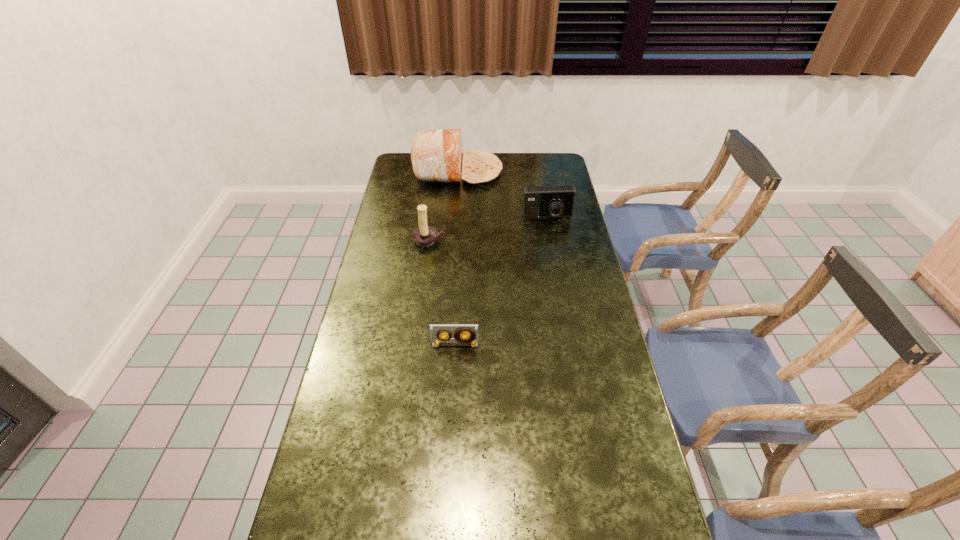
The height and width of the screenshot is (540, 960). Find the location of `vacant space in between the candle holder and the shortest object`. vacant space in between the candle holder and the shortest object is located at coordinates (443, 293).

Locate an element on the screen. unoccupied area between the third nearest object and the candle holder is located at coordinates (489, 230).

Locate an element on the screen. The image size is (960, 540). free space between the third farthest object and the videotape is located at coordinates (443, 293).

The image size is (960, 540). I want to click on the second closest object to the rightmost object, so click(424, 236).

You are a GUI agent. You are given a task and a screenshot of the screen. Output one action in this format:
    pyautogui.click(x=<x>, y=<y>)
    Task: Click on the object that is the third closest to the farthest object
    Image resolution: width=960 pixels, height=540 pixels.
    Given the screenshot: What is the action you would take?
    pyautogui.click(x=437, y=331)